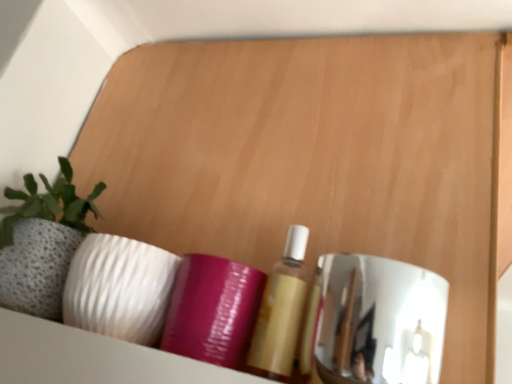
What are the coordinates of `purple glossy tube at center, positioned as the 1th toiletry in left-to-right order` in the screenshot? It's located at (212, 309).

What do you see at coordinates (281, 310) in the screenshot? This screenshot has height=384, width=512. I see `matte gold bottle at center, marked as the second toiletry in a left-to-right arrangement` at bounding box center [281, 310].

What do you see at coordinates (379, 321) in the screenshot? I see `polished chrome mirror at right` at bounding box center [379, 321].

Image resolution: width=512 pixels, height=384 pixels. Identify the location of textured stone planter at left. (41, 242).

In the scene shown: Is polished chrome mirror at right not within matte gold bottle at center, marked as the second toiletry in a left-to-right arrangement?

Yes, polished chrome mirror at right is not within matte gold bottle at center, marked as the second toiletry in a left-to-right arrangement.

Is point (387, 364) behind point (304, 288)?

No, (387, 364) is closer to viewer.

Which object is closer to the camera, polished chrome mirror at right or matte gold bottle at center, marked as the second toiletry in a left-to-right arrangement?

polished chrome mirror at right is closer to the camera.

Can you confirm if polished chrome mirror at right is smaller than textured stone planter at left?

Correct, polished chrome mirror at right occupies less space than textured stone planter at left.

Based on the photo, does polished chrome mirror at right appear on the left side of textured stone planter at left?

No.

Looking at this image, does polished chrome mirror at right turn towards textured stone planter at left?

No, polished chrome mirror at right is not turned towards textured stone planter at left.

Measure the distance between polished chrome mirror at right and textured stone planter at left.

polished chrome mirror at right and textured stone planter at left are 13.87 inches apart from each other.

Is matte gold bottle at center, marked as the second toiletry in a left-to-right arrangement, not within purple glossy tube at center, positioned as the 1th toiletry in left-to-right order?

Yes, matte gold bottle at center, marked as the second toiletry in a left-to-right arrangement, is not within purple glossy tube at center, positioned as the 1th toiletry in left-to-right order.

From the image's perspective, who appears lower, matte gold bottle at center, marked as the second toiletry in a left-to-right arrangement, or purple glossy tube at center, positioned as the 1th toiletry in left-to-right order?

matte gold bottle at center, marked as the second toiletry in a left-to-right arrangement, appears lower in the image.

Is matte gold bottle at center, marked as the second toiletry in a left-to-right arrangement, turned away from purple glossy tube at center, positioned as the 1th toiletry in left-to-right order?

No.

How much distance is there between purple glossy tube at center, the second toiletry when ordered from right to left, and textured stone planter at left?

A distance of 8.13 inches exists between purple glossy tube at center, the second toiletry when ordered from right to left, and textured stone planter at left.

Can you confirm if purple glossy tube at center, positioned as the 1th toiletry in left-to-right order, is positioned to the right of textured stone planter at left?

Indeed, purple glossy tube at center, positioned as the 1th toiletry in left-to-right order, is positioned on the right side of textured stone planter at left.

Does purple glossy tube at center, the second toiletry when ordered from right to left, have a smaller size compared to textured stone planter at left?

Yes.

Is point (206, 328) positioned before point (30, 217)?

Yes, it is in front of point (30, 217).

From a real-world perspective, between textured stone planter at left and matte gold bottle at center, marked as the second toiletry in a left-to-right arrangement, who is vertically higher?

textured stone planter at left.

Between textured stone planter at left and matte gold bottle at center, positioned as the first toiletry in right-to-left order, which one has smaller size?

matte gold bottle at center, positioned as the first toiletry in right-to-left order.

Is textured stone planter at left taller than matte gold bottle at center, marked as the second toiletry in a left-to-right arrangement?

Indeed, textured stone planter at left has a greater height compared to matte gold bottle at center, marked as the second toiletry in a left-to-right arrangement.

Can you tell me how much textured stone planter at left and matte gold bottle at center, marked as the second toiletry in a left-to-right arrangement, differ in facing direction?

textured stone planter at left and matte gold bottle at center, marked as the second toiletry in a left-to-right arrangement, are facing 0.000479 degrees away from each other.

From the image's perspective, between polished chrome mirror at right and purple glossy tube at center, positioned as the 1th toiletry in left-to-right order, which one is located above?

purple glossy tube at center, positioned as the 1th toiletry in left-to-right order, is shown above in the image.

Is polished chrome mirror at right to the right of purple glossy tube at center, the second toiletry when ordered from right to left, from the viewer's perspective?

Yes, polished chrome mirror at right is to the right of purple glossy tube at center, the second toiletry when ordered from right to left.

In the scene shown: Is the depth of polished chrome mirror at right less than that of purple glossy tube at center, the second toiletry when ordered from right to left?

Yes, polished chrome mirror at right is closer to the viewer.

Which of these two, polished chrome mirror at right or purple glossy tube at center, positioned as the 1th toiletry in left-to-right order, stands shorter?

purple glossy tube at center, positioned as the 1th toiletry in left-to-right order.

Considering the relative positions of purple glossy tube at center, positioned as the 1th toiletry in left-to-right order, and matte gold bottle at center, marked as the second toiletry in a left-to-right arrangement, in the image provided, is purple glossy tube at center, positioned as the 1th toiletry in left-to-right order, behind matte gold bottle at center, marked as the second toiletry in a left-to-right arrangement,?

That is True.

Identify the location of toiletry above the matte gold bottle at center, positioned as the first toiletry in right-to-left order (from the image's perspective). (212, 309).

Is purple glossy tube at center, the second toiletry when ordered from right to left, facing away from matte gold bottle at center, marked as the second toiletry in a left-to-right arrangement?

No, matte gold bottle at center, marked as the second toiletry in a left-to-right arrangement, is not at the back of purple glossy tube at center, the second toiletry when ordered from right to left.

Considering the sizes of objects purple glossy tube at center, the second toiletry when ordered from right to left, and matte gold bottle at center, positioned as the first toiletry in right-to-left order, in the image provided, who is thinner, purple glossy tube at center, the second toiletry when ordered from right to left, or matte gold bottle at center, positioned as the first toiletry in right-to-left order,?

matte gold bottle at center, positioned as the first toiletry in right-to-left order, is thinner.

Which toiletry is the 1st one when counting from the back of the polished chrome mirror at right? Please provide its 2D coordinates.

[(281, 310)]

Locate an element on the screen. The height and width of the screenshot is (384, 512). houseplant above the polished chrome mirror at right (from a real-world perspective) is located at coordinates (41, 242).

Looking at the image, which one is located closer to textured stone planter at left, purple glossy tube at center, the second toiletry when ordered from right to left, or polished chrome mirror at right?

Based on the image, purple glossy tube at center, the second toiletry when ordered from right to left, appears to be nearer to textured stone planter at left.

Based on their spatial positions, is textured stone planter at left or polished chrome mirror at right further from matte gold bottle at center, positioned as the first toiletry in right-to-left order?

textured stone planter at left.

Looking at the image, which one is located closer to textured stone planter at left, polished chrome mirror at right or purple glossy tube at center, positioned as the 1th toiletry in left-to-right order?

purple glossy tube at center, positioned as the 1th toiletry in left-to-right order, lies closer to textured stone planter at left than the other object.

Which object lies nearer to the anchor point matte gold bottle at center, marked as the second toiletry in a left-to-right arrangement, textured stone planter at left or purple glossy tube at center, the second toiletry when ordered from right to left?

Among the two, purple glossy tube at center, the second toiletry when ordered from right to left, is located nearer to matte gold bottle at center, marked as the second toiletry in a left-to-right arrangement.

Estimate the real-world distances between objects in this image. Which object is closer to textured stone planter at left, polished chrome mirror at right or matte gold bottle at center, marked as the second toiletry in a left-to-right arrangement?

matte gold bottle at center, marked as the second toiletry in a left-to-right arrangement, lies closer to textured stone planter at left than the other object.

Considering their positions, is purple glossy tube at center, the second toiletry when ordered from right to left, positioned further to polished chrome mirror at right than matte gold bottle at center, marked as the second toiletry in a left-to-right arrangement?

purple glossy tube at center, the second toiletry when ordered from right to left, lies further to polished chrome mirror at right than the other object.

Considering their positions, is polished chrome mirror at right positioned further to purple glossy tube at center, the second toiletry when ordered from right to left, than matte gold bottle at center, marked as the second toiletry in a left-to-right arrangement?

polished chrome mirror at right.

From the image, which object appears to be nearer to purple glossy tube at center, positioned as the 1th toiletry in left-to-right order, matte gold bottle at center, marked as the second toiletry in a left-to-right arrangement, or textured stone planter at left?

matte gold bottle at center, marked as the second toiletry in a left-to-right arrangement, lies closer to purple glossy tube at center, positioned as the 1th toiletry in left-to-right order, than the other object.

The width and height of the screenshot is (512, 384). Identify the location of toiletry between textured stone planter at left and matte gold bottle at center, marked as the second toiletry in a left-to-right arrangement, in the horizontal direction. (212, 309).

Image resolution: width=512 pixels, height=384 pixels. Find the location of `toiletry between purple glossy tube at center, positioned as the 1th toiletry in left-to-right order, and polished chrome mirror at right from left to right`. toiletry between purple glossy tube at center, positioned as the 1th toiletry in left-to-right order, and polished chrome mirror at right from left to right is located at coordinates (281, 310).